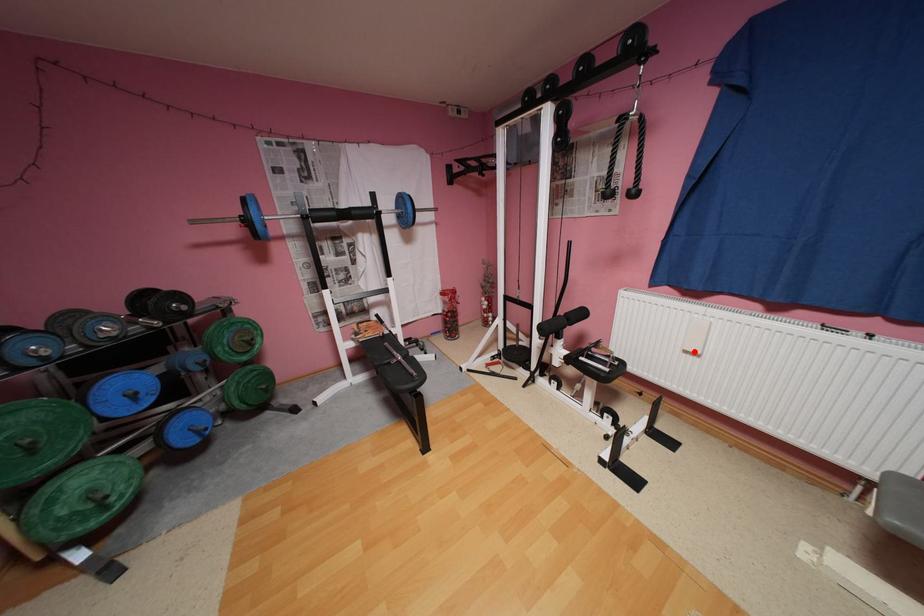
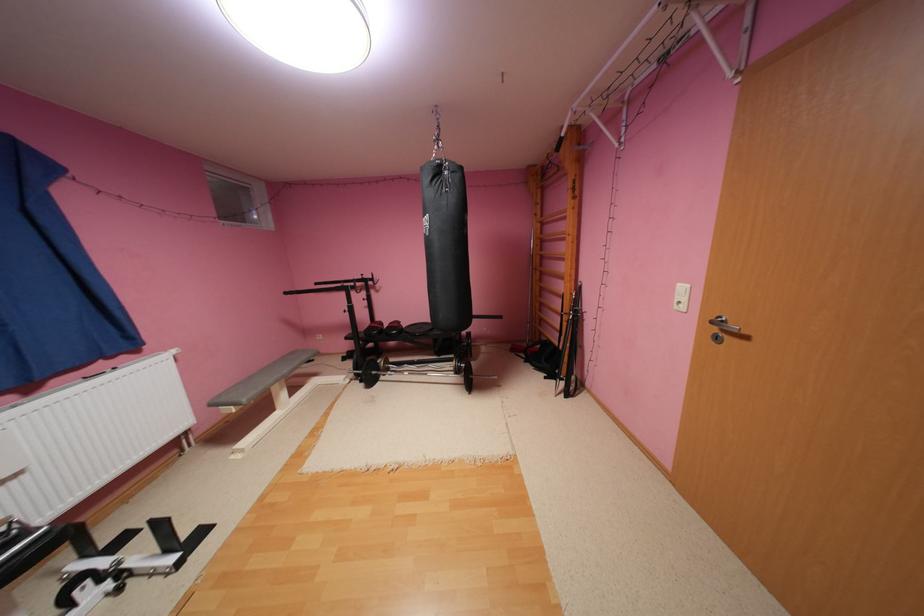
Question: I am providing you with two images of the same scene from different viewpoints. Image1 has a red point marked. In image2, the corresponding 3D location appears at what relative position? Reply with the corresponding letter.

Choices:
 (A) Closer
 (B) Farther

Answer: (B)